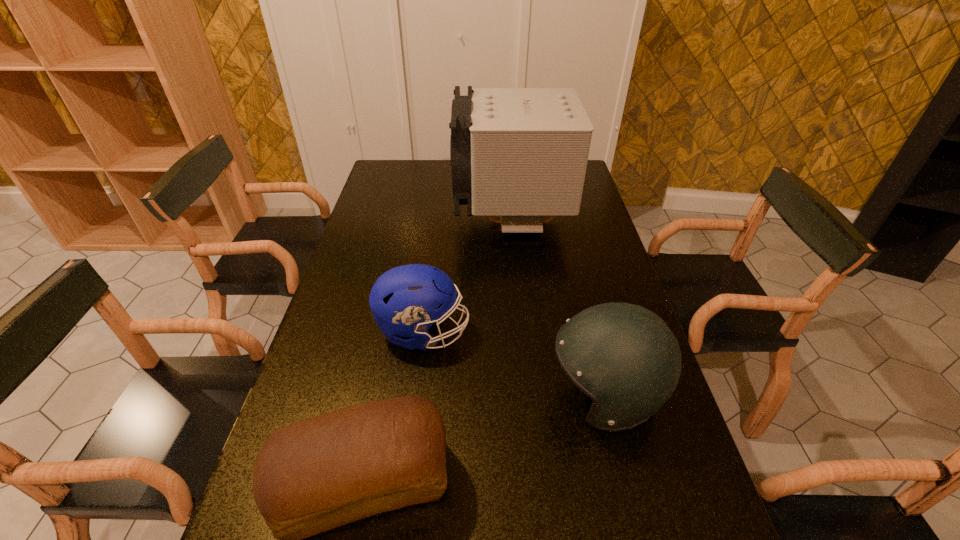
Identify which object is the second nearest to the right football helmet. Please provide its 2D coordinates. Your answer should be formatted as a tuple, i.e. [(x, y)], where the tuple contains the x and y coordinates of a point satisfying the conditions above.

[(314, 475)]